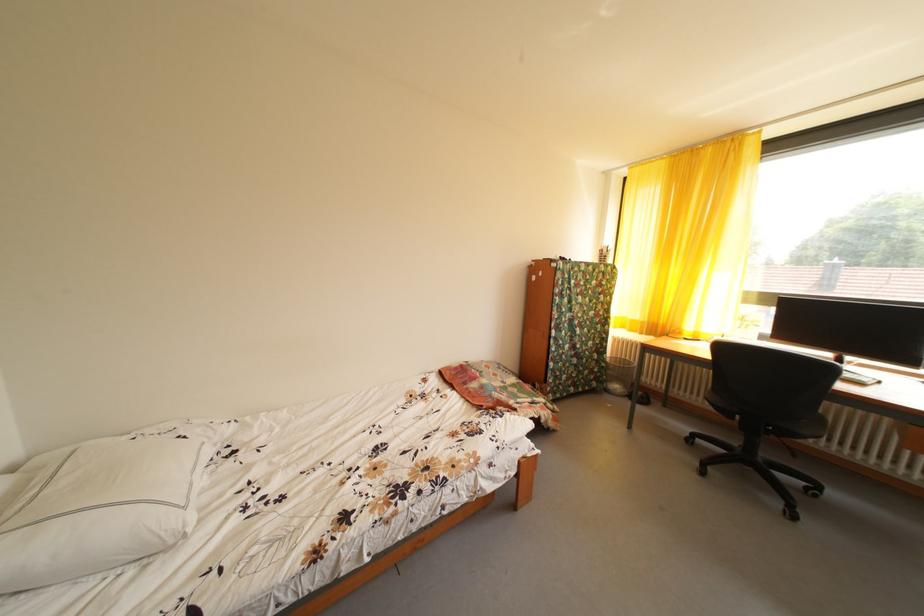
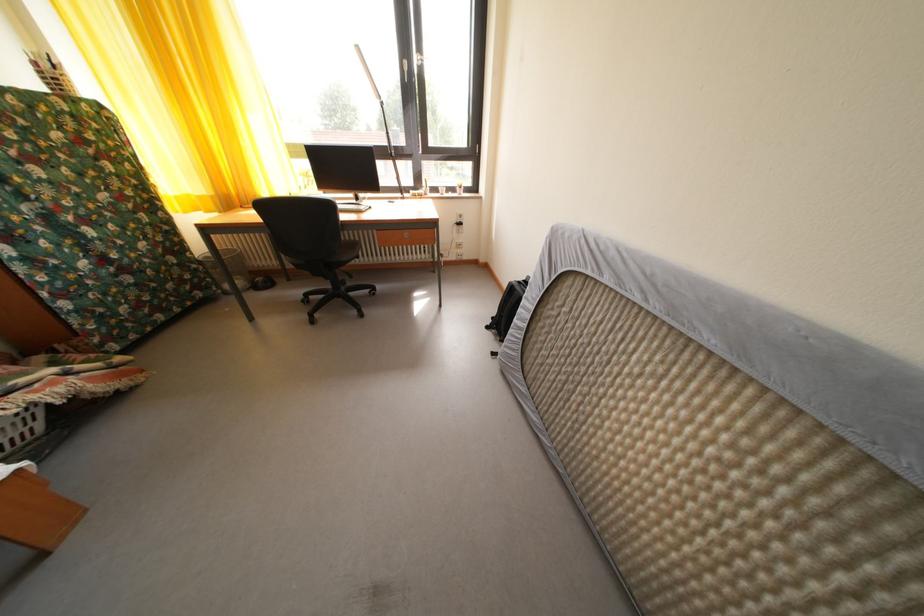
Where in the second image is the point corresponding to point 545,422 from the first image?

(23, 418)